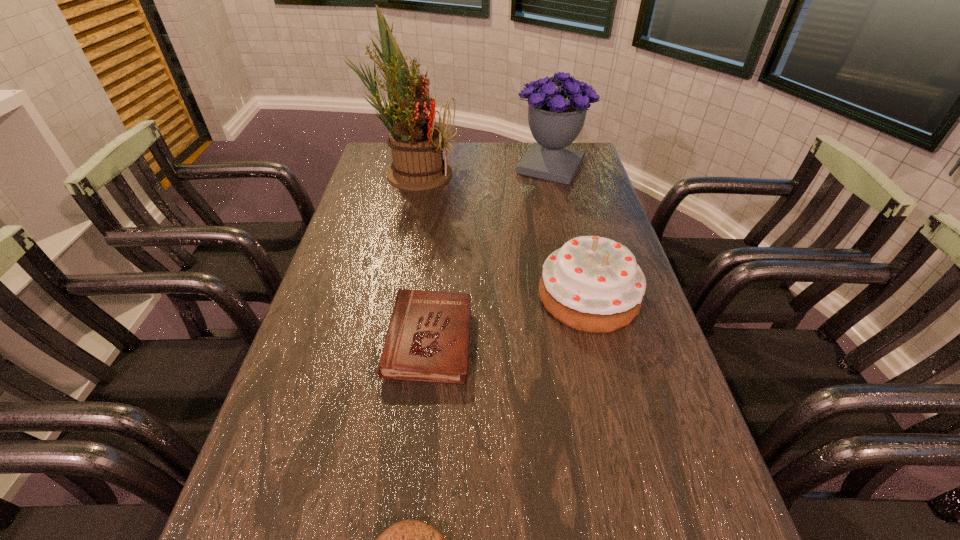
The image size is (960, 540). I want to click on vacant area between the hardback book and the third tallest object, so click(509, 319).

This screenshot has width=960, height=540. In order to click on vacant space that is in between the cake and the tallest object in this screenshot , I will do `click(500, 234)`.

Identify the location of free space between the bouquet and the third tallest object. (569, 232).

The height and width of the screenshot is (540, 960). Find the location of `free space between the hardback book and the tallest object`. free space between the hardback book and the tallest object is located at coordinates (420, 256).

Find the location of a particular element. The image size is (960, 540). free space between the third shortest object and the fourth tallest object is located at coordinates (509, 319).

The width and height of the screenshot is (960, 540). I want to click on vacant area between the bouquet and the second shortest object, so tap(490, 254).

You are a GUI agent. You are given a task and a screenshot of the screen. Output one action in this format:
    pyautogui.click(x=<x>, y=<y>)
    Task: Click on the free space between the tallest object and the cake
    
    Given the screenshot: What is the action you would take?
    pyautogui.click(x=500, y=234)

Locate which object is the closest to the third tallest object. Please provide its 2D coordinates. Your answer should be formatted as a tuple, i.e. [(x, y)], where the tuple contains the x and y coordinates of a point satisfying the conditions above.

[(427, 340)]

Where is `object that stands as the third closest to the bouquet`? object that stands as the third closest to the bouquet is located at coordinates (427, 340).

Identify the location of vacant space that satisfies the following two spatial constraints: 1. in front of the hardback book with the fan visible; 2. on the right side of the tallest object. (374, 341).